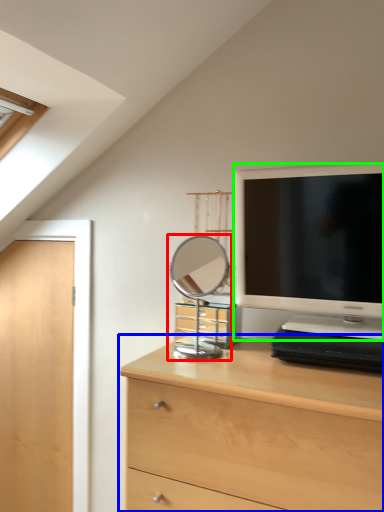
Question: Which object is the farthest from mirror (highlighted by a red box)? Choose among these: chest of drawers (highlighted by a blue box) or television (highlighted by a green box).

Choices:
 (A) chest of drawers
 (B) television

Answer: (A)